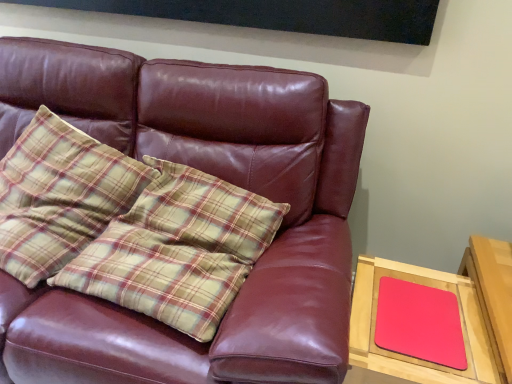
Question: Are plaid fabric pillow at left and matte leather couch at center making contact?

Choices:
 (A) no
 (B) yes

Answer: (A)

Question: From a real-world perspective, is plaid fabric pillow at left over matte leather couch at center?

Choices:
 (A) no
 (B) yes

Answer: (B)

Question: Is plaid fabric pillow at left outside of matte leather couch at center?

Choices:
 (A) no
 (B) yes

Answer: (A)

Question: Can you confirm if plaid fabric pillow at left is shorter than matte leather couch at center?

Choices:
 (A) no
 (B) yes

Answer: (B)

Question: Does plaid fabric pillow at left appear on the left side of matte leather couch at center?

Choices:
 (A) no
 (B) yes

Answer: (B)

Question: Is the depth of plaid fabric pillow at left greater than that of matte leather couch at center?

Choices:
 (A) no
 (B) yes

Answer: (B)

Question: Does matte leather couch at center have a smaller size compared to matte pink mousepad at right?

Choices:
 (A) yes
 (B) no

Answer: (B)

Question: Is matte leather couch at center located outside matte pink mousepad at right?

Choices:
 (A) no
 (B) yes

Answer: (B)

Question: From the image's perspective, is matte leather couch at center located beneath matte pink mousepad at right?

Choices:
 (A) yes
 (B) no

Answer: (B)

Question: Is matte leather couch at center thinner than matte pink mousepad at right?

Choices:
 (A) no
 (B) yes

Answer: (A)

Question: Considering the relative sizes of matte leather couch at center and matte pink mousepad at right in the image provided, is matte leather couch at center wider than matte pink mousepad at right?

Choices:
 (A) yes
 (B) no

Answer: (A)

Question: Considering the relative sizes of matte leather couch at center and matte pink mousepad at right in the image provided, is matte leather couch at center bigger than matte pink mousepad at right?

Choices:
 (A) yes
 (B) no

Answer: (A)

Question: Is matte pink mousepad at right positioned far away from matte pink mousepad at right?

Choices:
 (A) yes
 (B) no

Answer: (B)